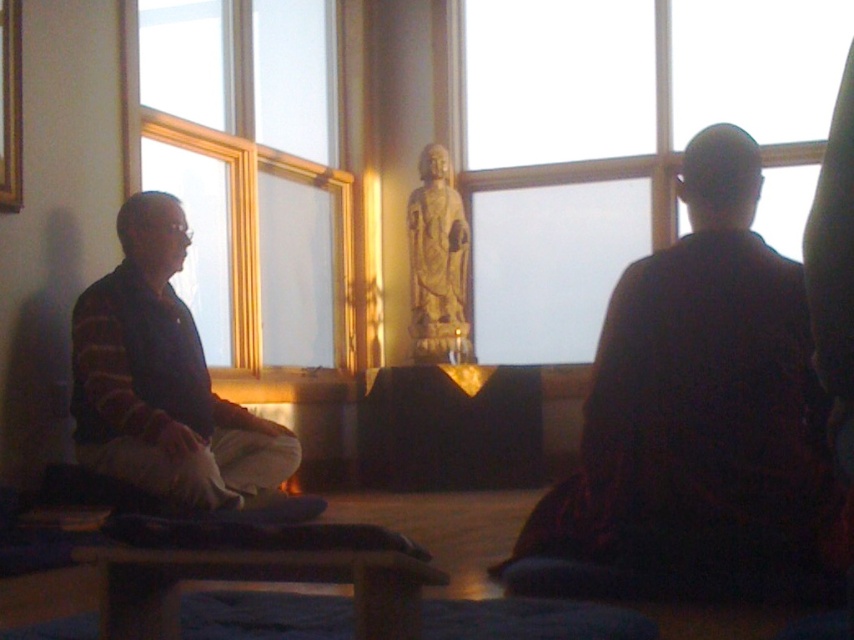
Question: Is black velvet robe at right to the right of stone statue at center from the viewer's perspective?

Choices:
 (A) yes
 (B) no

Answer: (A)

Question: Which is nearer to the dark brown sweater at left?

Choices:
 (A) transparent glass window at center
 (B) black velvet robe at right
 (C) stone statue at center
 (D) transparent glass window at upper left

Answer: (D)

Question: Can you confirm if transparent glass window at center is positioned to the left of transparent glass window at upper left?

Choices:
 (A) yes
 (B) no

Answer: (B)

Question: Which object appears farthest from the camera in this image?

Choices:
 (A) dark brown sweater at left
 (B) transparent glass window at upper left
 (C) black velvet robe at right

Answer: (B)

Question: Among these objects, which one is farthest from the camera?

Choices:
 (A) black velvet robe at right
 (B) transparent glass window at upper left
 (C) dark brown sweater at left
 (D) stone statue at center

Answer: (D)

Question: Can you confirm if dark brown sweater at left is positioned below stone statue at center?

Choices:
 (A) no
 (B) yes

Answer: (B)